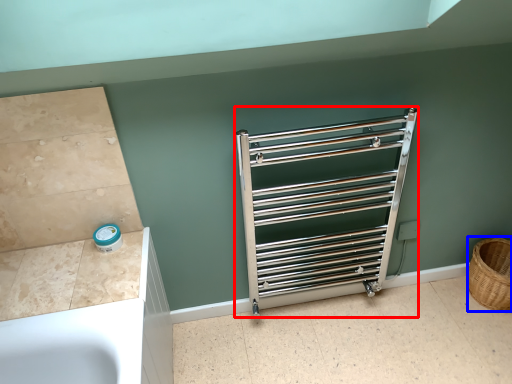
Question: Which object is further to the camera taking this photo, cage (highlighted by a red box) or basket (highlighted by a blue box)?

Choices:
 (A) cage
 (B) basket

Answer: (B)